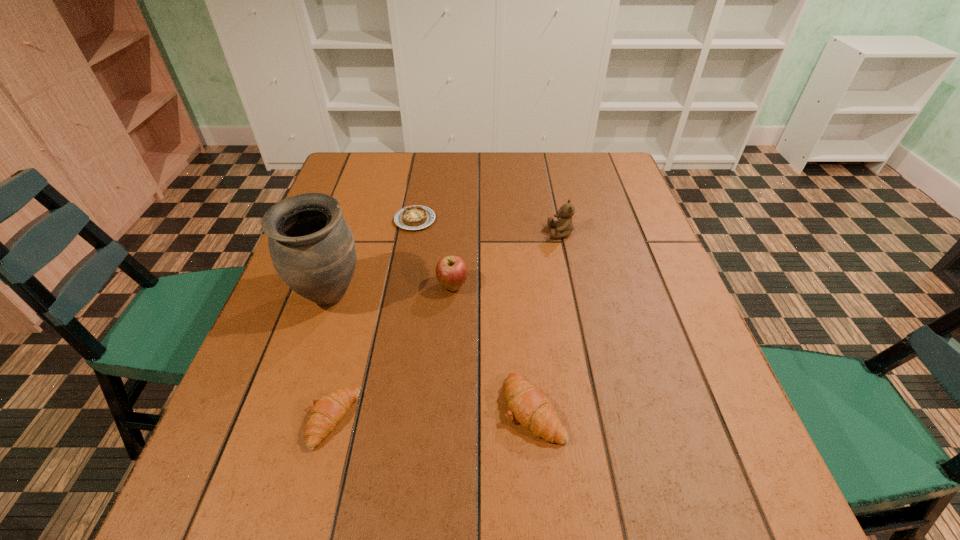
Find the location of a particular element. The width and height of the screenshot is (960, 540). vacant space located 0.090m on the front-facing side of the rightmost object is located at coordinates (514, 233).

Where is `free point located 0.220m on the front-facing side of the rightmost object`? This screenshot has width=960, height=540. free point located 0.220m on the front-facing side of the rightmost object is located at coordinates (465, 233).

This screenshot has height=540, width=960. Identify the location of free region located on the front-facing side of the rightmost object. (408, 233).

The image size is (960, 540). In order to click on vacant space located 0.050m on the right of the quiche in this screenshot , I will do `click(454, 220)`.

Where is `vacant region located on the back of the urn`? vacant region located on the back of the urn is located at coordinates (363, 199).

The width and height of the screenshot is (960, 540). What are the coordinates of `free region located 0.380m on the back of the fourth object from left to right` in the screenshot? It's located at (459, 187).

This screenshot has height=540, width=960. In order to click on crescent roll at the left edge in this screenshot , I will do `click(327, 411)`.

Where is `urn located at the left edge`? This screenshot has width=960, height=540. urn located at the left edge is located at coordinates (312, 248).

This screenshot has width=960, height=540. What are the coordinates of `object located in the near left corner section of the desktop` in the screenshot? It's located at (327, 411).

The height and width of the screenshot is (540, 960). Identify the location of free region at the far edge of the desktop. (558, 187).